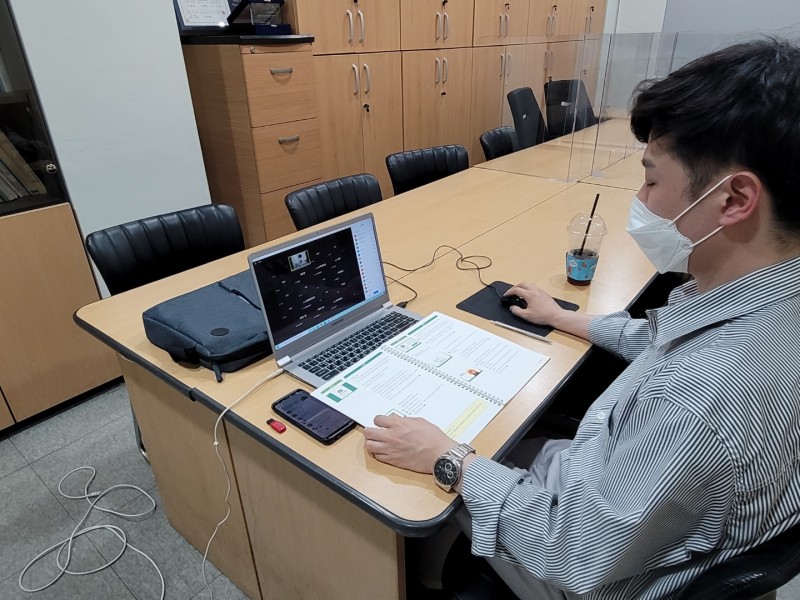
Where is `2 tall black chairs`? The width and height of the screenshot is (800, 600). 2 tall black chairs is located at coordinates (534, 124), (560, 97).